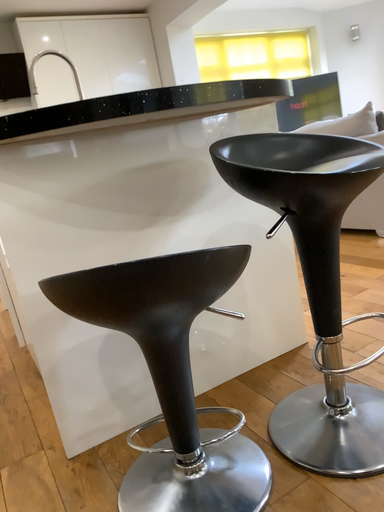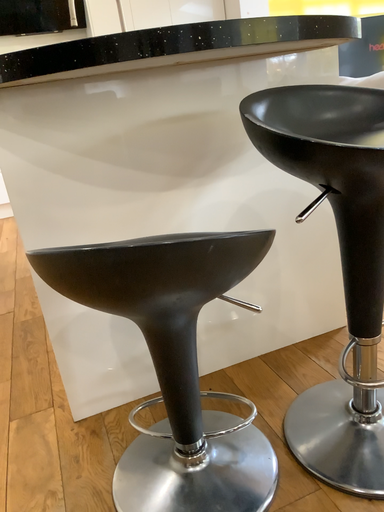
Question: Which way did the camera rotate in the video?

Choices:
 (A) rotated downward
 (B) rotated upward

Answer: (A)